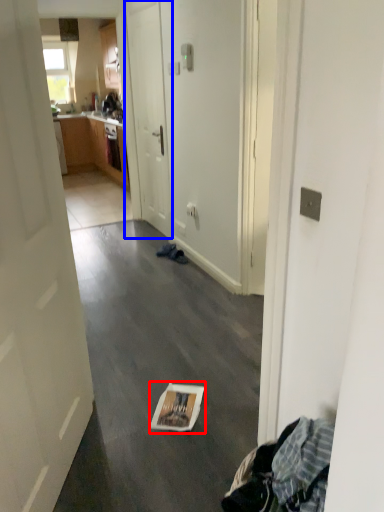
Question: Which of the following is the closest to the observer, magazine (highlighted by a red box) or door (highlighted by a blue box)?

Choices:
 (A) magazine
 (B) door

Answer: (A)